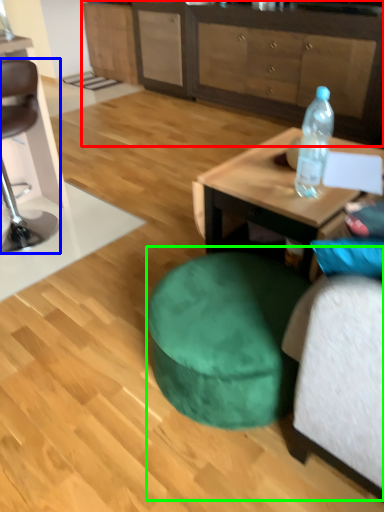
Question: Considering the real-world distances, which object is farthest from cabinetry (highlighted by a red box)? chair (highlighted by a blue box) or bean bag chair (highlighted by a green box)?

Choices:
 (A) chair
 (B) bean bag chair

Answer: (B)